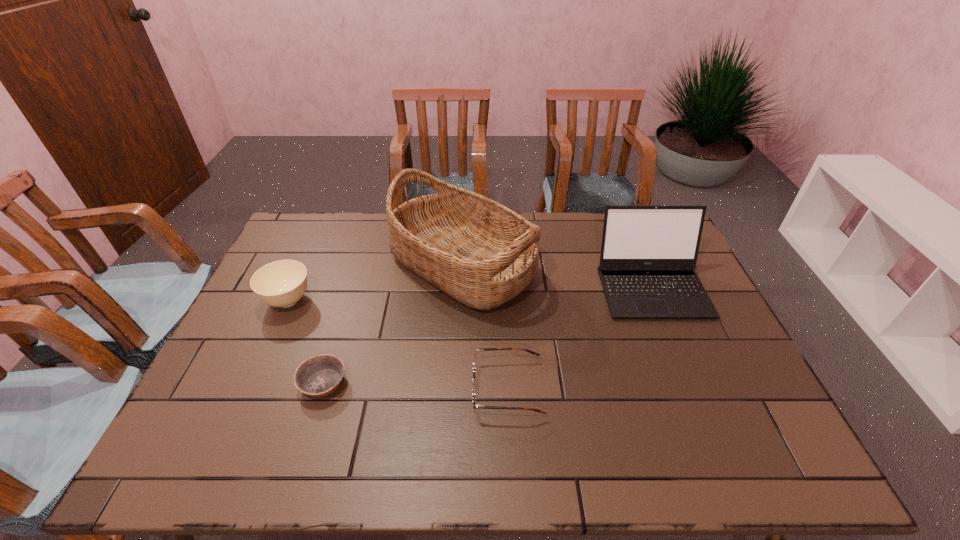
Locate an element on the screen. This screenshot has height=540, width=960. basket is located at coordinates (479, 252).

Image resolution: width=960 pixels, height=540 pixels. Find the location of `the second tallest object`. the second tallest object is located at coordinates (648, 257).

You are a GUI agent. You are given a task and a screenshot of the screen. Output one action in this format:
    pyautogui.click(x=<x>, y=<y>)
    Task: Click on the rightmost object
    The height and width of the screenshot is (540, 960).
    Given the screenshot: What is the action you would take?
    pyautogui.click(x=648, y=257)

Where is `sugar bowl`? The height and width of the screenshot is (540, 960). sugar bowl is located at coordinates (282, 283).

The width and height of the screenshot is (960, 540). Find the location of `the third shortest object`. the third shortest object is located at coordinates (282, 283).

You are a GUI agent. You are given a task and a screenshot of the screen. Output one action in this format:
    pyautogui.click(x=<x>, y=<y>)
    Task: Click on the spectacles
    
    Given the screenshot: What is the action you would take?
    pyautogui.click(x=474, y=389)

What are the coordinates of `the second object from left to right` in the screenshot? It's located at (320, 375).

Where is `the shortest object`? the shortest object is located at coordinates (320, 375).

The height and width of the screenshot is (540, 960). In order to click on free space located on the right of the basket in this screenshot , I will do `click(602, 265)`.

Where is `vacant space located 0.220m on the surface of the second tallest object`? vacant space located 0.220m on the surface of the second tallest object is located at coordinates (692, 384).